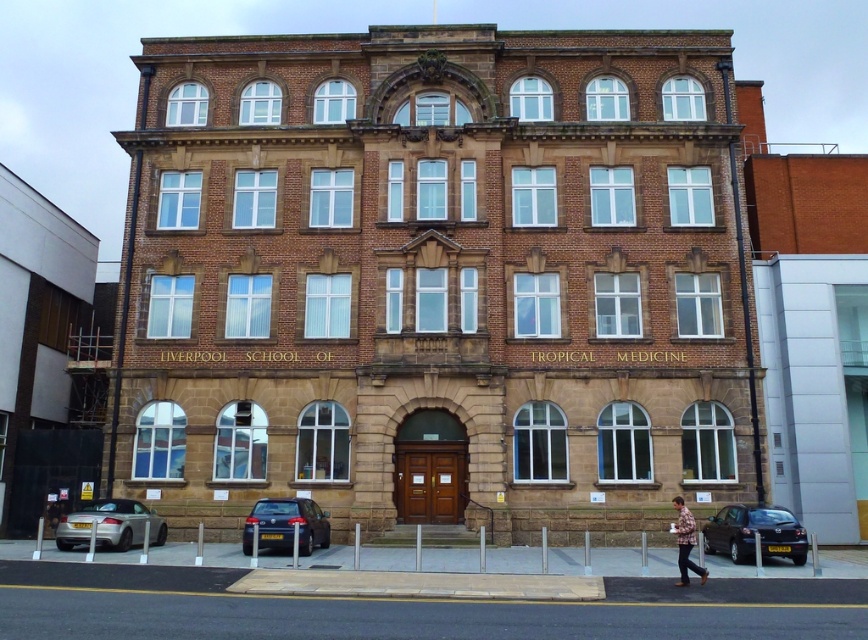
From the picture: You are standing in front of the Liverpool School of Tropical Medic building and want to locate two specific points on its facade. The first point is at coordinates point (301,529) and the second is at point (687,556). Which of these two points is closer to your current position?

Point (301,529) is closer to your current position because it is further to the camera than point (687,556).

What is the 2D coordinate position of the dark blue metallic car at lower left in the image?

The dark blue metallic car at lower left is located at the 2D coordinate point of (x=286, y=524).